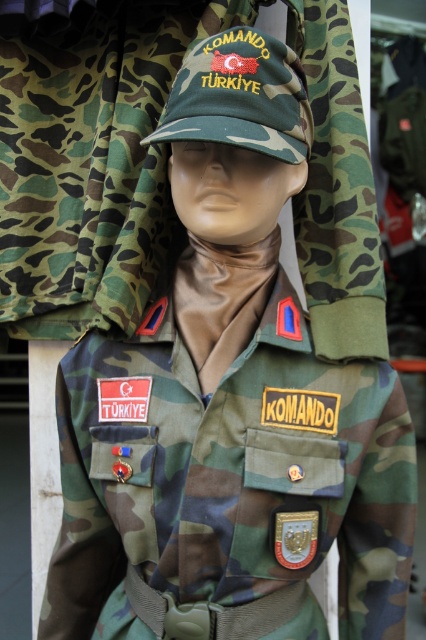
Who is lower down, camo fabric jacket at upper center or camouflage fabric cap at center?

Positioned lower is camo fabric jacket at upper center.

Looking at this image, is camo fabric jacket at upper center shorter than camouflage fabric cap at center?

No.

Where is `camo fabric jacket at upper center`? The image size is (426, 640). camo fabric jacket at upper center is located at coordinates (92, 164).

This screenshot has width=426, height=640. I want to click on camo fabric jacket at upper center, so click(92, 164).